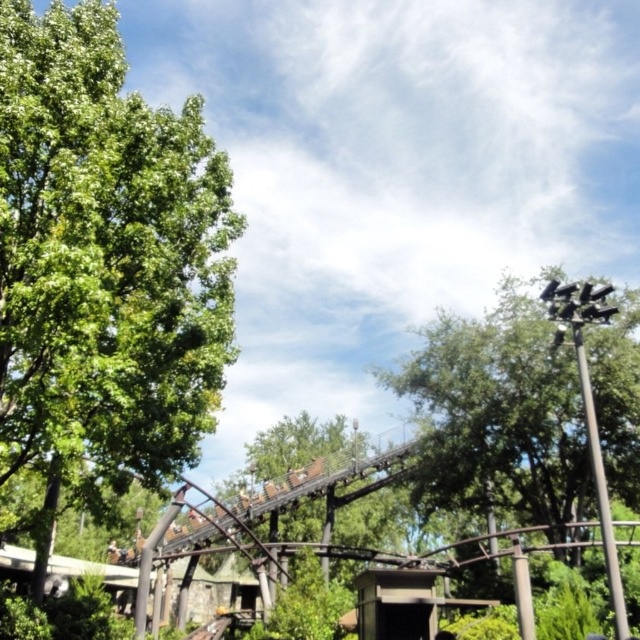
You are standing at the center of the roller coaster track and want to locate the green leafy tree at left. Based on the coordinates provided, in which direction should you look to see it?

The green leafy tree at left is located at point coordinates, so you should look to the left side of the roller coaster track to see it.

You are standing at the base of the roller coaster track and notice two green leafy trees in the scene. Which tree, the green leafy tree at left or the green leafy tree at upper right, is closer to you?

The green leafy tree at left is closer to you because it is positioned over the green leafy tree at upper right, indicating it is in front of it.